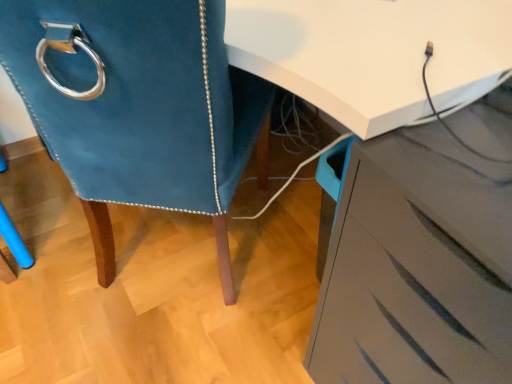
Question: Should I look upward or downward to see matte gray chest of drawers at lower right?

Choices:
 (A) up
 (B) down

Answer: (B)

Question: Can velvet blue chair at left be found inside matte gray chest of drawers at lower right?

Choices:
 (A) no
 (B) yes

Answer: (A)

Question: Is matte gray chest of drawers at lower right looking in the opposite direction of velvet blue chair at left?

Choices:
 (A) yes
 (B) no

Answer: (B)

Question: From a real-world perspective, is matte gray chest of drawers at lower right located beneath velvet blue chair at left?

Choices:
 (A) no
 (B) yes

Answer: (B)

Question: Does matte gray chest of drawers at lower right appear on the left side of velvet blue chair at left?

Choices:
 (A) yes
 (B) no

Answer: (B)

Question: Is matte gray chest of drawers at lower right shorter than velvet blue chair at left?

Choices:
 (A) no
 (B) yes

Answer: (B)

Question: Considering the relative sizes of matte gray chest of drawers at lower right and velvet blue chair at left in the image provided, is matte gray chest of drawers at lower right thinner than velvet blue chair at left?

Choices:
 (A) no
 (B) yes

Answer: (B)

Question: Can you confirm if velvet blue chair at left is positioned to the right of matte gray chest of drawers at lower right?

Choices:
 (A) no
 (B) yes

Answer: (A)

Question: Considering the relative sizes of velvet blue chair at left and matte gray chest of drawers at lower right in the image provided, is velvet blue chair at left wider than matte gray chest of drawers at lower right?

Choices:
 (A) yes
 (B) no

Answer: (A)

Question: Considering the relative sizes of velvet blue chair at left and matte gray chest of drawers at lower right in the image provided, is velvet blue chair at left thinner than matte gray chest of drawers at lower right?

Choices:
 (A) no
 (B) yes

Answer: (A)

Question: Are velvet blue chair at left and matte gray chest of drawers at lower right located far from each other?

Choices:
 (A) yes
 (B) no

Answer: (B)

Question: Is velvet blue chair at left turned away from matte gray chest of drawers at lower right?

Choices:
 (A) no
 (B) yes

Answer: (A)

Question: Can you confirm if velvet blue chair at left is taller than matte gray chest of drawers at lower right?

Choices:
 (A) yes
 (B) no

Answer: (A)

Question: Looking at the image, does velvet blue chair at left seem bigger or smaller compared to matte gray chest of drawers at lower right?

Choices:
 (A) big
 (B) small

Answer: (A)